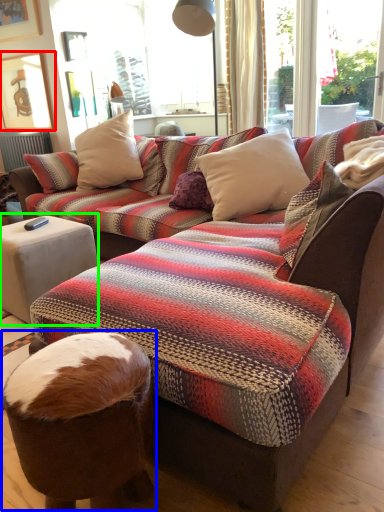
Question: Which object is positioned farthest from picture frame (highlighted by a red box)? Select from bean bag chair (highlighted by a blue box) and side table (highlighted by a green box).

Choices:
 (A) bean bag chair
 (B) side table

Answer: (A)